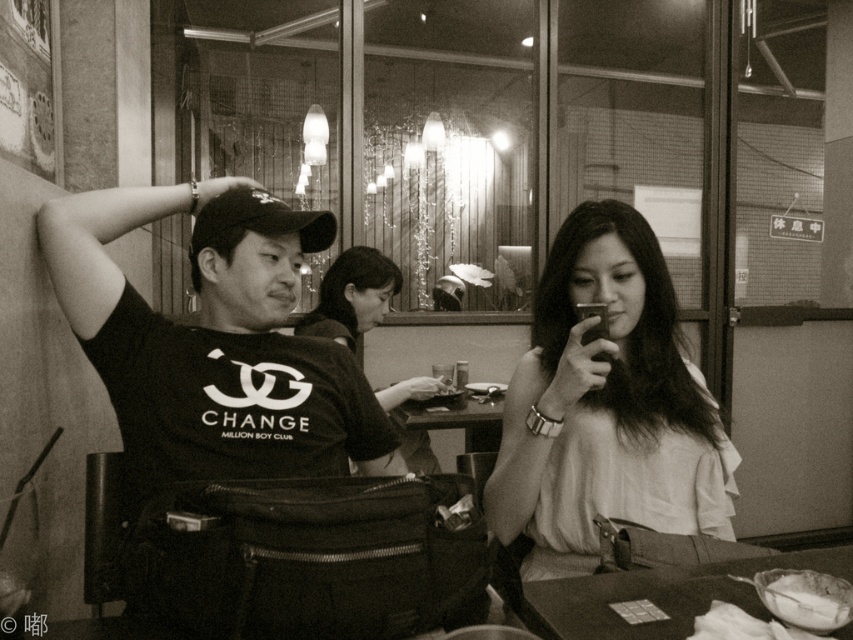
You are standing at the origin of the coordinate system in the image. You want to walk to point A at point [219,449] and point B at point [553,541]. Which point will you reach first?

Point A at point [219,449] is in front of point B at point [553,541], so you will reach point A first.

Based on the photo, you are a photographer trying to capture a closeup of the white creamy food at lower right without including the smooth fabric blouse at center in the frame. Is it possible to do so given their positions?

The smooth fabric blouse at center might be wider than white creamy food at lower right, so there is a possibility that the blouse could block the view of the food. To ensure the food is fully visible, adjust the camera angle to avoid the blouse.